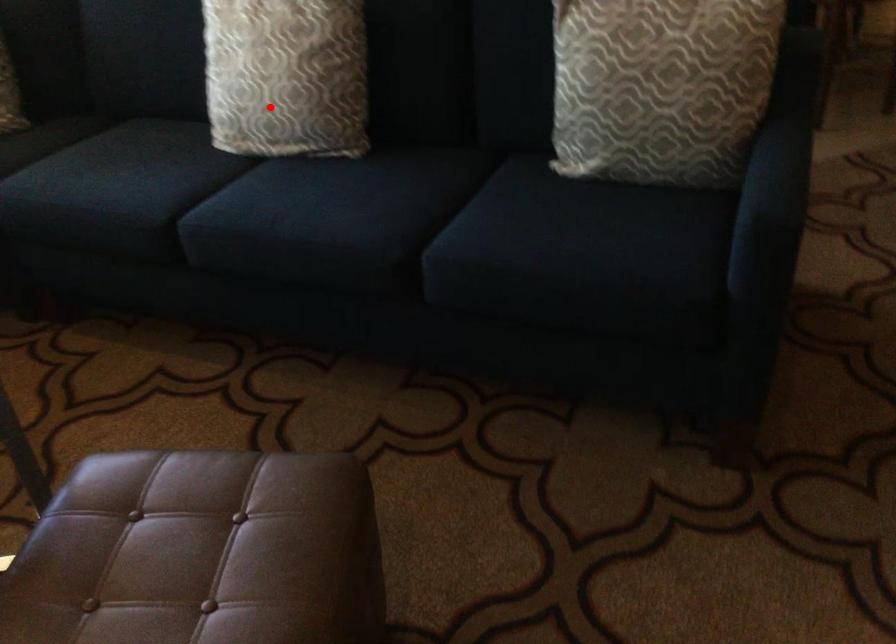
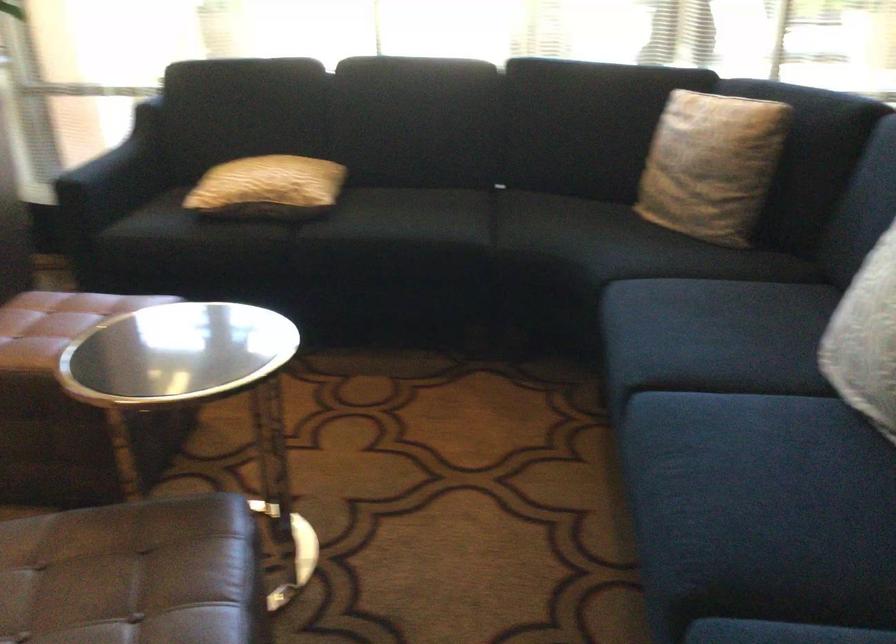
Find the pixel in the second image that matches the highlighted location in the first image.

(866, 339)